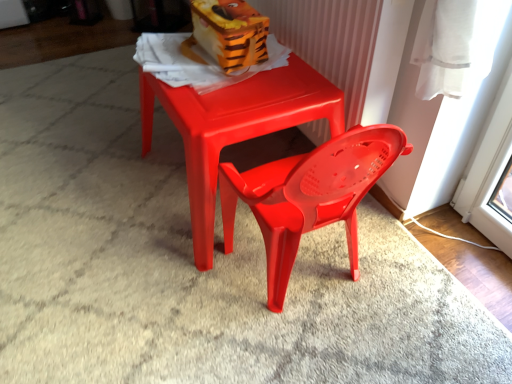
What do you see at coordinates (234, 127) in the screenshot? I see `matte plastic table at center` at bounding box center [234, 127].

The image size is (512, 384). What are the coordinates of `matte plastic table at center` in the screenshot? It's located at (234, 127).

Where is `orange plastic toy at upper center`? orange plastic toy at upper center is located at coordinates (230, 32).

In order to face orange plastic toy at upper center, should I rotate leftwards or rightwards?

A 5.490 degree turn to the left will do.

Describe the element at coordinates (230, 32) in the screenshot. This screenshot has height=384, width=512. I see `orange plastic toy at upper center` at that location.

Identify the location of matte plastic table at center. (234, 127).

Based on their positions, is matte plastic table at center located to the left or right of orange plastic toy at upper center?

matte plastic table at center is positioned on orange plastic toy at upper center's right side.

Which object is more forward, matte plastic table at center or orange plastic toy at upper center?

matte plastic table at center.

Is point (241, 109) positioned before point (261, 31)?

Yes, point (241, 109) is in front of point (261, 31).

From the image's perspective, which one is positioned higher, matte plastic table at center or orange plastic toy at upper center?

From the image's view, orange plastic toy at upper center is above.

From a real-world perspective, is matte plastic table at center under orange plastic toy at upper center?

Yes.

Is matte plastic table at center wider than orange plastic toy at upper center?

Indeed, matte plastic table at center has a greater width compared to orange plastic toy at upper center.

Is matte plastic table at center taller or shorter than orange plastic toy at upper center?

matte plastic table at center is taller than orange plastic toy at upper center.

Between matte plastic table at center and orange plastic toy at upper center, which one has smaller size?

orange plastic toy at upper center is smaller.

Would you say matte plastic table at center contains orange plastic toy at upper center?

No, orange plastic toy at upper center is not inside matte plastic table at center.

From the picture: Is the surface of matte plastic table at center in direct contact with orange plastic toy at upper center?

No, matte plastic table at center is not touching orange plastic toy at upper center.

Consider the image. Could you tell me if matte plastic table at center is facing orange plastic toy at upper center?

No, matte plastic table at center is not facing towards orange plastic toy at upper center.

At what (x,y) coordinates should I click in order to perform the action: click on table below the orange plastic toy at upper center (from the image's perspective). Please return your answer as a coordinate pair (x, y). Image resolution: width=512 pixels, height=384 pixels. Looking at the image, I should click on (234, 127).

Is orange plastic toy at upper center at the right side of matte plastic table at center?

No, orange plastic toy at upper center is not to the right of matte plastic table at center.

Which object is further away from the camera, orange plastic toy at upper center or matte plastic table at center?

orange plastic toy at upper center is more distant.

Is point (226, 13) less distant than point (292, 122)?

No, it is behind (292, 122).

From the image's perspective, which one is positioned higher, orange plastic toy at upper center or matte plastic table at center?

orange plastic toy at upper center.

From a real-world perspective, relative to matte plastic table at center, is orange plastic toy at upper center vertically above or below?

Clearly, from a real-world perspective, orange plastic toy at upper center is above matte plastic table at center.

Can you confirm if orange plastic toy at upper center is thinner than matte plastic table at center?

Indeed, orange plastic toy at upper center has a lesser width compared to matte plastic table at center.

Who is taller, orange plastic toy at upper center or matte plastic table at center?

Standing taller between the two is matte plastic table at center.

In terms of size, does orange plastic toy at upper center appear bigger or smaller than matte plastic table at center?

In the image, orange plastic toy at upper center appears to be smaller than matte plastic table at center.

Would you say orange plastic toy at upper center contains matte plastic table at center?

No.

Is orange plastic toy at upper center positioned far away from matte plastic table at center?

No, orange plastic toy at upper center is not far away from matte plastic table at center.

From the picture: Does orange plastic toy at upper center turn towards matte plastic table at center?

No, orange plastic toy at upper center is not aimed at matte plastic table at center.

Based on the photo, what's the angular difference between orange plastic toy at upper center and matte plastic table at center's facing directions?

The angle between the facing direction of orange plastic toy at upper center and the facing direction of matte plastic table at center is 0.000251 degrees.

This screenshot has width=512, height=384. What are the coordinates of `toy that is behind the matte plastic table at center` in the screenshot? It's located at (230, 32).

Find the location of `table that is on the right side of orange plastic toy at upper center`. table that is on the right side of orange plastic toy at upper center is located at coordinates (234, 127).

I want to click on toy on the left side of matte plastic table at center, so click(230, 32).